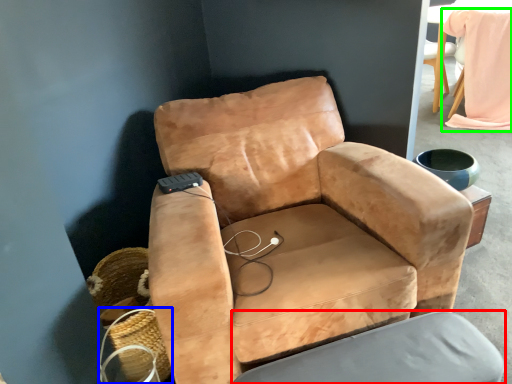
Question: Which object is the closest to the swivel chair (highlighted by a red box)? Choose among these: basket (highlighted by a blue box) or bean bag chair (highlighted by a green box).

Choices:
 (A) basket
 (B) bean bag chair

Answer: (A)